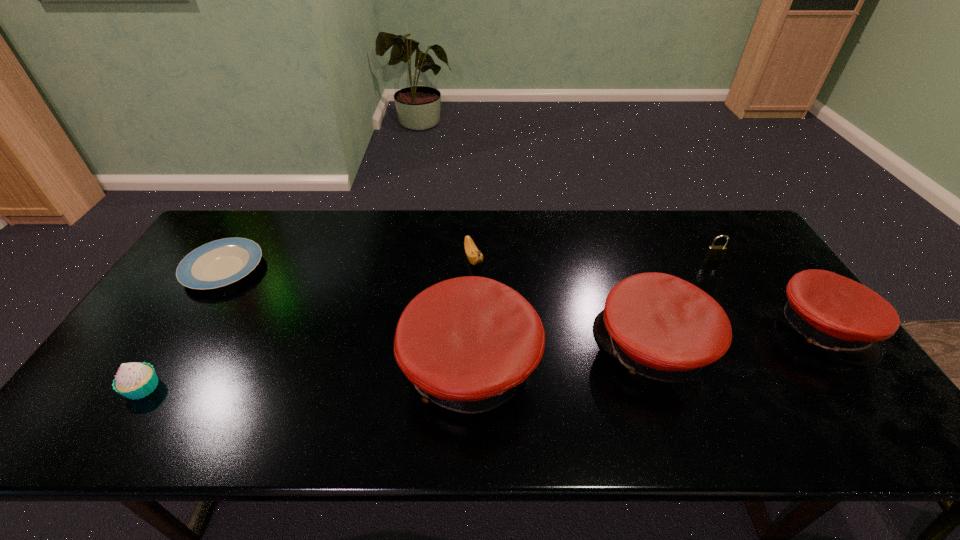
Find the location of a particular element. This screenshot has height=540, width=960. free space at the left edge of the desktop is located at coordinates (123, 349).

In the image, there is a desktop. At what (x,y) coordinates should I click in order to perform the action: click on vacant space at the far left corner. Please return your answer as a coordinate pair (x, y). The width and height of the screenshot is (960, 540). Looking at the image, I should click on (213, 240).

I want to click on vacant region at the far right corner of the desktop, so click(x=699, y=211).

Locate an element on the screen. free space between the cupcake and the plate is located at coordinates tap(183, 328).

Find the location of a particular element. unoccupied area between the banana and the plate is located at coordinates (348, 264).

Locate an element on the screen. The width and height of the screenshot is (960, 540). free space between the leftmost cap and the padlock is located at coordinates (591, 313).

The image size is (960, 540). I want to click on vacant area between the plate and the sixth object from left to right, so click(468, 264).

Identify the location of free spot between the padlock and the rightmost cap. The height and width of the screenshot is (540, 960). (767, 294).

Where is `free space between the banana and the shortest object`? free space between the banana and the shortest object is located at coordinates (348, 264).

Identify which object is located as the sixth nearest to the shortest cap. Please provide its 2D coordinates. Your answer should be formatted as a tuple, i.e. [(x, y)], where the tuple contains the x and y coordinates of a point satisfying the conditions above.

[(135, 380)]